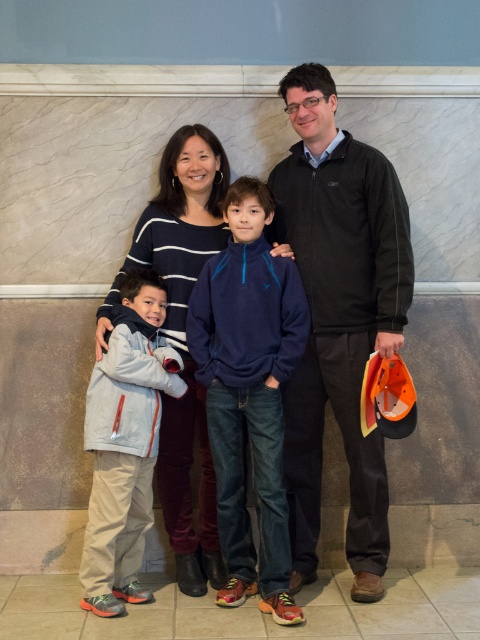
Consider the image. You are taking a photo of the family and want to adjust the focus so that both point A at point (312, 532) and point B at point (300, 436) are in sharp focus. Which point should you focus on first to ensure both are in focus?

You should focus on point B at point (300, 436) first because it is closer to the camera than point A at point (312, 532). By focusing on the closer point, the depth of field will extend to cover the farther point as well.

Based on the scene description, which child is wearing the matte blue sweatshirt at center and is taller than the dark gray fleece sweater at center?

The matte blue sweatshirt at center is taller than the dark gray fleece sweater at center, so the child wearing the matte blue sweatshirt at center is taller.